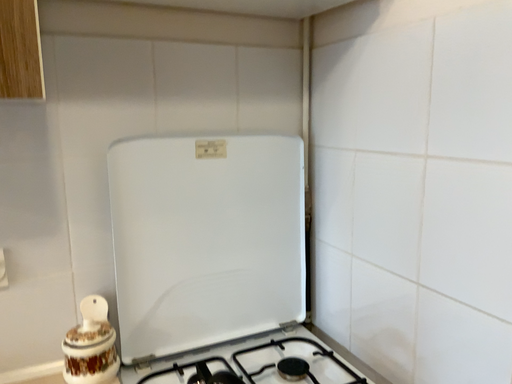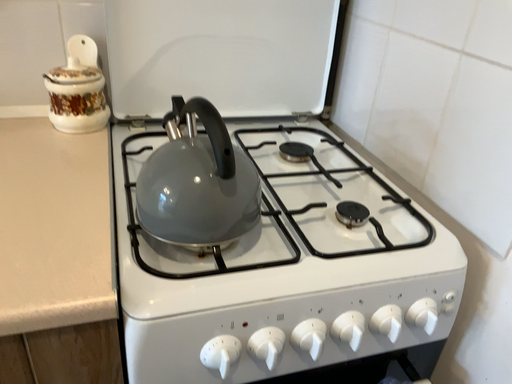
Question: Which way did the camera rotate in the video?

Choices:
 (A) rotated right
 (B) rotated left

Answer: (B)